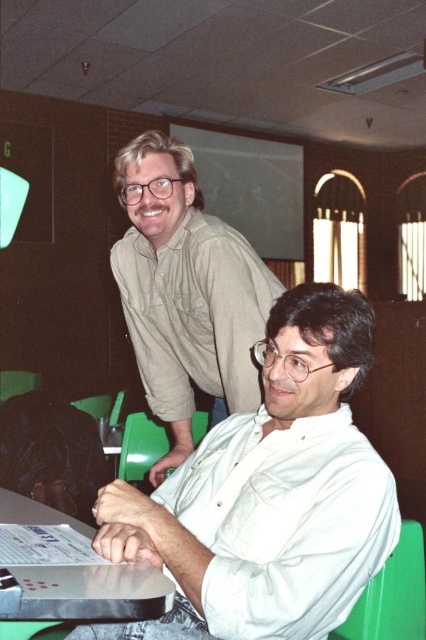
Can you confirm if light brown shirt at upper center is positioned to the right of green plastic chair at lower center?

Correct, you'll find light brown shirt at upper center to the right of green plastic chair at lower center.

How much distance is there between light brown shirt at upper center and green plastic chair at lower center?

The distance of light brown shirt at upper center from green plastic chair at lower center is 39.30 inches.

Who is more distant from viewer, (137, 321) or (154, 452)?

Point (154, 452)

The height and width of the screenshot is (640, 426). Identify the location of light brown shirt at upper center. (x=186, y=291).

Which is behind, point (215, 422) or point (100, 604)?

Positioned behind is point (215, 422).

Is point (222, 333) more distant than point (11, 637)?

Yes.

Identify the location of light brown shirt at upper center. (186, 291).

The width and height of the screenshot is (426, 640). I want to click on light brown shirt at upper center, so click(186, 291).

Image resolution: width=426 pixels, height=640 pixels. What do you see at coordinates (393, 595) in the screenshot?
I see `green plastic chair at lower right` at bounding box center [393, 595].

Locate an element on the screen. green plastic chair at lower right is located at coordinates (393, 595).